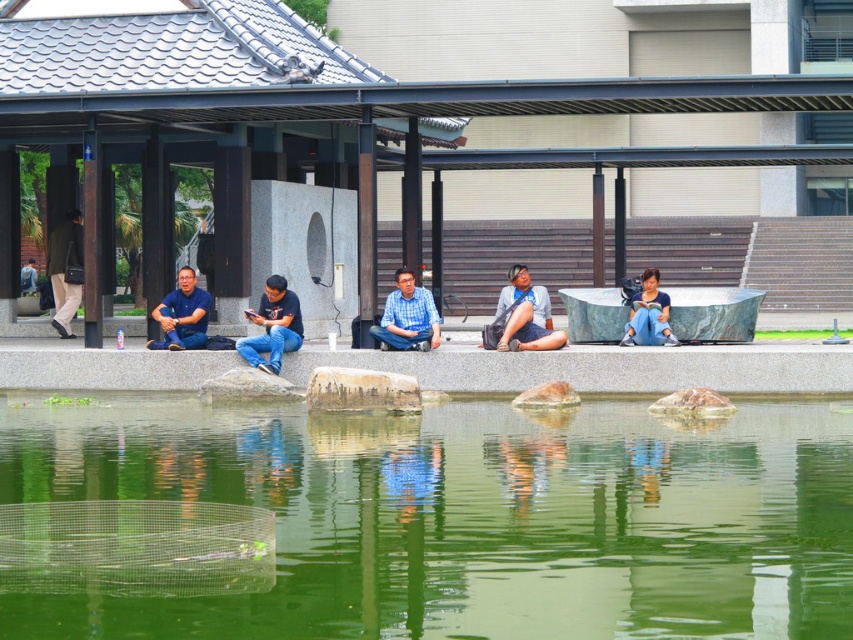
You are designing a small boat that can only carry items with a width of up to 1 meter. You need to decide whether to place the green liquid water at center or the brown rough stone at center into the boat. Which one can fit based on their widths?

The green liquid water at center has a larger width than the brown rough stone at center. Since the boat can only carry items with a width of up to 1 meter, the brown rough stone at center is narrower and can fit into the boat, while the green liquid water at center might exceed the width limit.

You are designing a clothing catalog and need to know the relative sizes of the items in the image. Which item, the matte blue shirt at left or the blue fabric pants at center, is bigger?

The matte blue shirt at left is larger in size compared to the blue fabric pants at center.

You are a photographer trying to capture a candid shot of the denim shorts at center and the matte blue jeans at center. Since you want to focus on both equally, which one should you zoom in on more to ensure they appear balanced in the frame?

The denim shorts at center is smaller than the matte blue jeans at center, so you should zoom in more on the denim shorts at center to balance their sizes in the photo.